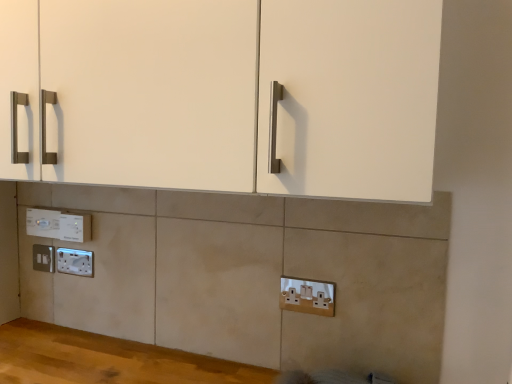
Where is `white plastic socket at lower center, which is the fifth electric outlet in back-to-front order`? white plastic socket at lower center, which is the fifth electric outlet in back-to-front order is located at coordinates (307, 296).

Describe the element at coordinates (75, 262) in the screenshot. This screenshot has width=512, height=384. I see `white plastic socket at lower left, acting as the third electric outlet starting from the left` at that location.

Describe the element at coordinates (44, 258) in the screenshot. I see `white plastic electric outlet at lower left, which ranks as the fifth electric outlet in right-to-left order` at that location.

This screenshot has width=512, height=384. In order to click on white plastic electric outlet at lower left, arranged as the 1th electric outlet when viewed from the left in this screenshot , I will do `click(44, 258)`.

The height and width of the screenshot is (384, 512). Find the location of `white plastic socket at lower center, the 1th electric outlet viewed from the right`. white plastic socket at lower center, the 1th electric outlet viewed from the right is located at coordinates (307, 296).

Can you see white plastic electric outlet at lower left, which ranks as the fifth electric outlet in right-to-left order, touching white plastic socket at lower left, which is counted as the third electric outlet, starting from the front?

Yes, white plastic electric outlet at lower left, which ranks as the fifth electric outlet in right-to-left order, is in contact with white plastic socket at lower left, which is counted as the third electric outlet, starting from the front.

From a real-world perspective, who is located lower, white plastic electric outlet at lower left, arranged as the 1th electric outlet when viewed from the left, or white plastic socket at lower left, the third electric outlet in the back-to-front sequence?

In real-world perspective, white plastic socket at lower left, the third electric outlet in the back-to-front sequence, is lower.

From the image's perspective, which one is positioned higher, white plastic electric outlet at lower left, which ranks as the fifth electric outlet in right-to-left order, or white plastic socket at lower left, which is counted as the third electric outlet, starting from the front?

From the image's view, white plastic electric outlet at lower left, which ranks as the fifth electric outlet in right-to-left order, is above.

Is white plastic socket at lower left, which is counted as the third electric outlet, starting from the front, at the back of white plastic electric outlet at lower left, arranged as the 1th electric outlet when viewed from the left?

No.

Which object is closer to the camera, white plastic electric outlet at lower left, placed as the 4th electric outlet when sorted from right to left, or white plastic socket at lower left, acting as the third electric outlet starting from the left?

Positioned in front is white plastic socket at lower left, acting as the third electric outlet starting from the left.

Is white plastic socket at lower left, the third electric outlet positioned from the right, a part of white plastic electric outlet at lower left, which appears as the second electric outlet when viewed from the left?

That's incorrect, white plastic socket at lower left, the third electric outlet positioned from the right, is not inside white plastic electric outlet at lower left, which appears as the second electric outlet when viewed from the left.

From a real-world perspective, who is located lower, white plastic electric outlet at lower left, placed as the 4th electric outlet when sorted from right to left, or white plastic socket at lower left, the third electric outlet in the back-to-front sequence?

white plastic socket at lower left, the third electric outlet in the back-to-front sequence.

How many degrees apart are the facing directions of white plastic electric outlet at lower left, placed as the 4th electric outlet when sorted from front to back, and white plastic socket at lower center, arranged as the 5th electric outlet when viewed from the left?

white plastic electric outlet at lower left, placed as the 4th electric outlet when sorted from front to back, and white plastic socket at lower center, arranged as the 5th electric outlet when viewed from the left, are facing 2.3 degrees away from each other.

Is white plastic socket at lower center, the 1th electric outlet viewed from the right, inside white plastic electric outlet at lower left, placed as the 4th electric outlet when sorted from right to left?

No, white plastic electric outlet at lower left, placed as the 4th electric outlet when sorted from right to left, does not contain white plastic socket at lower center, the 1th electric outlet viewed from the right.

From the image's perspective, does white plastic electric outlet at lower left, the second electric outlet viewed from the back, appear lower than white plastic socket at lower center, the 1th electric outlet viewed from the right?

No.

In the scene shown: Is white plastic electric outlet at lower left, which appears as the second electric outlet when viewed from the left, aimed at white plastic socket at lower center, which ranks as the 1th electric outlet in front-to-back order?

No, white plastic electric outlet at lower left, which appears as the second electric outlet when viewed from the left, is not facing towards white plastic socket at lower center, which ranks as the 1th electric outlet in front-to-back order.

Is white plastic socket at lower center, the 1th electric outlet viewed from the right, to the left or to the right of white plastic electric outlet at lower left, the 2th electric outlet when ordered from right to left, in the image?

Based on their positions, white plastic socket at lower center, the 1th electric outlet viewed from the right, is located to the right of white plastic electric outlet at lower left, the 2th electric outlet when ordered from right to left.

Between point (313, 297) and point (59, 225), which one is positioned behind?

The point (59, 225) is farther.

Is white plastic socket at lower center, arranged as the 5th electric outlet when viewed from the left, with white plastic electric outlet at lower left, the 2th electric outlet viewed from the front?

No, white plastic socket at lower center, arranged as the 5th electric outlet when viewed from the left, is not with white plastic electric outlet at lower left, the 2th electric outlet viewed from the front.

Identify the location of the 1st electric outlet counting from the left side of the white plastic socket at lower center, which ranks as the 1th electric outlet in front-to-back order. (75, 227).

Is white plastic electric outlet at lower left, the 2th electric outlet viewed from the front, not near white plastic socket at lower left, acting as the third electric outlet starting from the left?

No, white plastic electric outlet at lower left, the 2th electric outlet viewed from the front, is not far from white plastic socket at lower left, acting as the third electric outlet starting from the left.

Does point (74, 214) lie in front of point (92, 273)?

Yes, it is in front of point (92, 273).

Considering the sizes of objects white plastic electric outlet at lower left, the 2th electric outlet when ordered from right to left, and white plastic socket at lower left, the third electric outlet in the back-to-front sequence, in the image provided, who is bigger, white plastic electric outlet at lower left, the 2th electric outlet when ordered from right to left, or white plastic socket at lower left, the third electric outlet in the back-to-front sequence,?

white plastic electric outlet at lower left, the 2th electric outlet when ordered from right to left.

Considering the relative positions of white plastic socket at lower center, which is the fifth electric outlet in back-to-front order, and white plastic electric outlet at lower left, the second electric outlet viewed from the back, in the image provided, is white plastic socket at lower center, which is the fifth electric outlet in back-to-front order, to the right of white plastic electric outlet at lower left, the second electric outlet viewed from the back, from the viewer's perspective?

Correct, you'll find white plastic socket at lower center, which is the fifth electric outlet in back-to-front order, to the right of white plastic electric outlet at lower left, the second electric outlet viewed from the back.

From a real-world perspective, between white plastic socket at lower center, the 1th electric outlet viewed from the right, and white plastic electric outlet at lower left, placed as the 4th electric outlet when sorted from right to left, who is vertically higher?

In real-world perspective, white plastic electric outlet at lower left, placed as the 4th electric outlet when sorted from right to left, is above.

Who is taller, white plastic socket at lower center, which is the fifth electric outlet in back-to-front order, or white plastic electric outlet at lower left, which appears as the second electric outlet when viewed from the left?

With more height is white plastic socket at lower center, which is the fifth electric outlet in back-to-front order.

The image size is (512, 384). What are the coordinates of `the 4th electric outlet positioned below the white plastic electric outlet at lower left, the second electric outlet viewed from the back (from the image's perspective)` in the screenshot? It's located at (307, 296).

From the image's perspective, would you say white plastic socket at lower left, which is counted as the third electric outlet, starting from the front, is positioned over white plastic socket at lower center, arranged as the 5th electric outlet when viewed from the left?

Indeed, from the image's perspective, white plastic socket at lower left, which is counted as the third electric outlet, starting from the front, is shown above white plastic socket at lower center, arranged as the 5th electric outlet when viewed from the left.

Is white plastic socket at lower center, which ranks as the 1th electric outlet in front-to-back order, a part of white plastic socket at lower left, which is counted as the third electric outlet, starting from the front?

No, white plastic socket at lower center, which ranks as the 1th electric outlet in front-to-back order, is located outside of white plastic socket at lower left, which is counted as the third electric outlet, starting from the front.

Based on their positions, is white plastic socket at lower left, acting as the third electric outlet starting from the left, located to the left or right of white plastic socket at lower center, which ranks as the 1th electric outlet in front-to-back order?

white plastic socket at lower left, acting as the third electric outlet starting from the left, is to the left of white plastic socket at lower center, which ranks as the 1th electric outlet in front-to-back order.

Can you confirm if white plastic socket at lower left, acting as the third electric outlet starting from the left, is smaller than white plastic socket at lower center, which is the fifth electric outlet in back-to-front order?

Yes.

At what (x,y) coordinates should I click in order to perform the action: click on electric outlet that is the 1st one when counting upward from the white plastic socket at lower left, acting as the third electric outlet starting from the left (from the image's perspective). Please return your answer as a coordinate pair (x, y). Image resolution: width=512 pixels, height=384 pixels. Looking at the image, I should click on (44, 258).

Locate an element on the screen. The image size is (512, 384). the 3rd electric outlet directly above the white plastic socket at lower left, the third electric outlet in the back-to-front sequence (from a real-world perspective) is located at coordinates (42, 222).

Estimate the real-world distances between objects in this image. Which object is further from white plastic electric outlet at lower left, which is the fourth electric outlet in back-to-front order, white plastic socket at lower center, arranged as the 5th electric outlet when viewed from the left, or white plastic electric outlet at lower left, placed as the 4th electric outlet when sorted from front to back?

white plastic socket at lower center, arranged as the 5th electric outlet when viewed from the left, lies further to white plastic electric outlet at lower left, which is the fourth electric outlet in back-to-front order, than the other object.

Looking at the image, which one is located closer to white plastic electric outlet at lower left, positioned as the 1th electric outlet in back-to-front order, white plastic socket at lower left, the third electric outlet in the back-to-front sequence, or white plastic electric outlet at lower left, the fourth electric outlet viewed from the left?

white plastic socket at lower left, the third electric outlet in the back-to-front sequence.

When comparing their distances from white plastic socket at lower left, which is counted as the third electric outlet, starting from the front, does white plastic electric outlet at lower left, the second electric outlet viewed from the back, or white plastic electric outlet at lower left, which ranks as the fifth electric outlet in right-to-left order, seem closer?

white plastic electric outlet at lower left, which ranks as the fifth electric outlet in right-to-left order, is positioned closer to the anchor white plastic socket at lower left, which is counted as the third electric outlet, starting from the front.

Considering their positions, is white plastic socket at lower center, the 1th electric outlet viewed from the right, positioned further to white plastic electric outlet at lower left, which is the fourth electric outlet in back-to-front order, than white plastic electric outlet at lower left, arranged as the 1th electric outlet when viewed from the left?

white plastic socket at lower center, the 1th electric outlet viewed from the right.

Looking at the image, which one is located further to white plastic socket at lower left, the third electric outlet in the back-to-front sequence, white plastic electric outlet at lower left, placed as the 4th electric outlet when sorted from front to back, or white plastic electric outlet at lower left, the fourth electric outlet viewed from the left?

white plastic electric outlet at lower left, placed as the 4th electric outlet when sorted from front to back.

Which object lies further to the anchor point white plastic electric outlet at lower left, the 2th electric outlet viewed from the front, white plastic electric outlet at lower left, the second electric outlet viewed from the back, or white plastic socket at lower left, which is counted as the third electric outlet, starting from the front?

Based on the image, white plastic socket at lower left, which is counted as the third electric outlet, starting from the front, appears to be further to white plastic electric outlet at lower left, the 2th electric outlet viewed from the front.

Looking at the image, which one is located closer to white plastic electric outlet at lower left, the second electric outlet viewed from the back, white plastic socket at lower left, acting as the third electric outlet starting from the left, or white plastic electric outlet at lower left, which appears as the fifth electric outlet when viewed from the front?

Among the two, white plastic electric outlet at lower left, which appears as the fifth electric outlet when viewed from the front, is located nearer to white plastic electric outlet at lower left, the second electric outlet viewed from the back.

Considering their positions, is white plastic electric outlet at lower left, the 2th electric outlet viewed from the front, positioned further to white plastic electric outlet at lower left, the second electric outlet viewed from the back, than white plastic socket at lower left, acting as the third electric outlet starting from the left?

Among the two, white plastic socket at lower left, acting as the third electric outlet starting from the left, is located further to white plastic electric outlet at lower left, the second electric outlet viewed from the back.

Where is `electric outlet between white plastic socket at lower left, acting as the third electric outlet starting from the left, and white plastic socket at lower center, the 1th electric outlet viewed from the right, from left to right`? This screenshot has height=384, width=512. electric outlet between white plastic socket at lower left, acting as the third electric outlet starting from the left, and white plastic socket at lower center, the 1th electric outlet viewed from the right, from left to right is located at coordinates (75, 227).